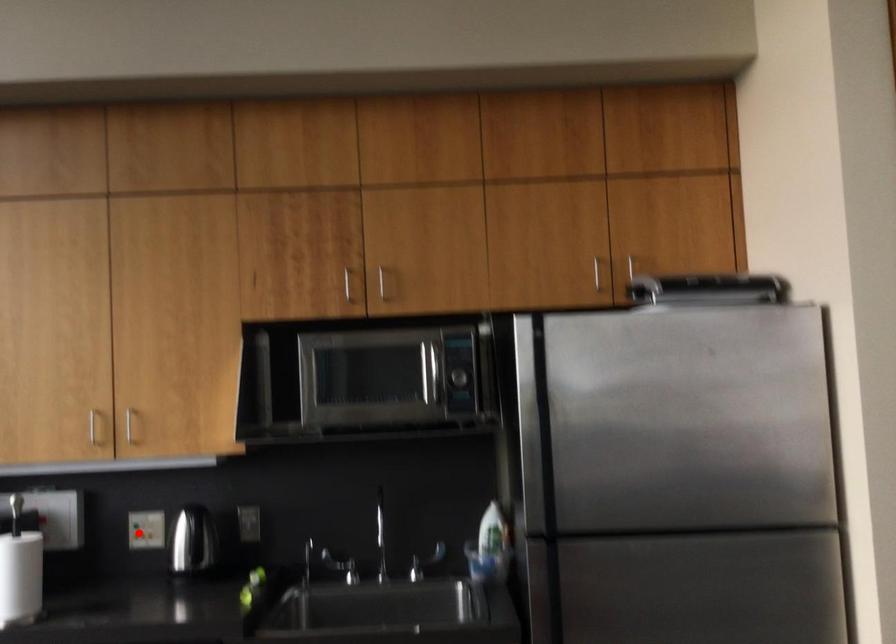
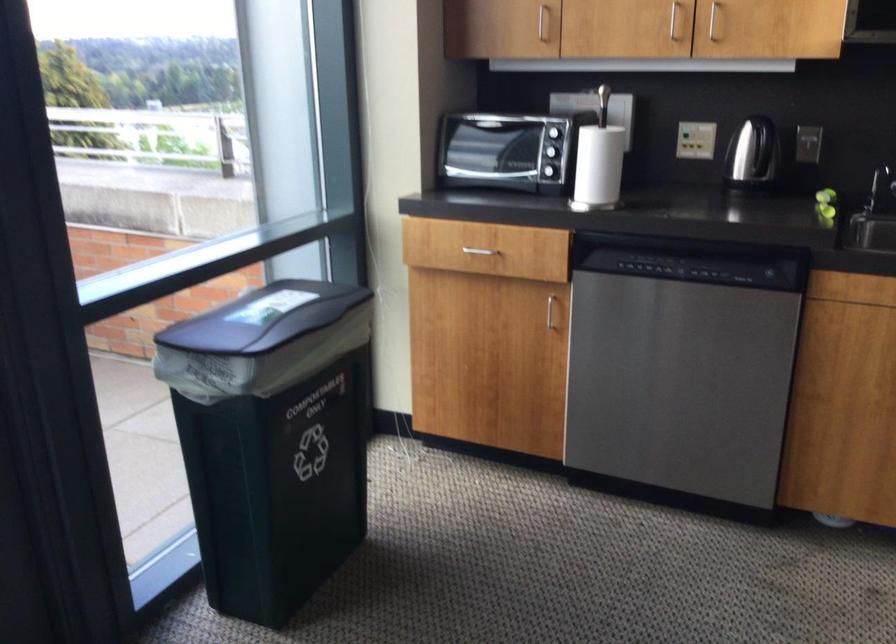
In the second image, find the point that corresponds to the highlighted location in the first image.

(695, 140)